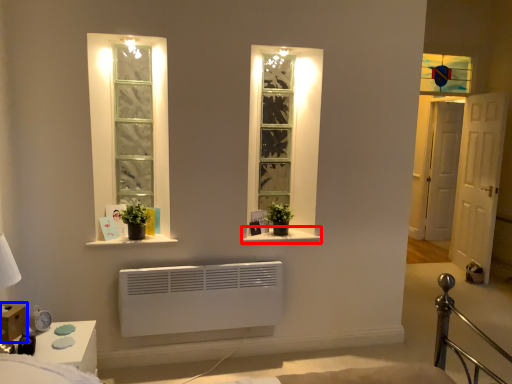
Question: Which point is further to the camera, window sill (highlighted by a red box) or window box (highlighted by a blue box)?

Choices:
 (A) window sill
 (B) window box

Answer: (A)